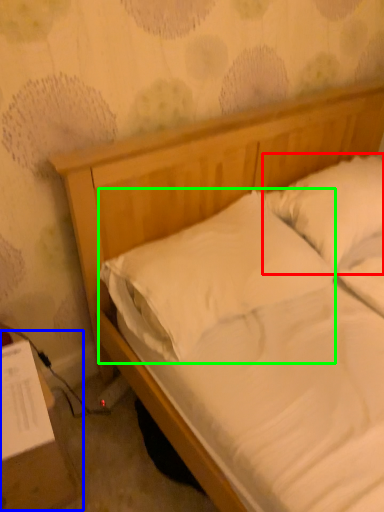
Question: Considering the real-world distances, which object is farthest from pillow (highlighted by a red box)? table (highlighted by a blue box) or pillow (highlighted by a green box)?

Choices:
 (A) table
 (B) pillow

Answer: (A)